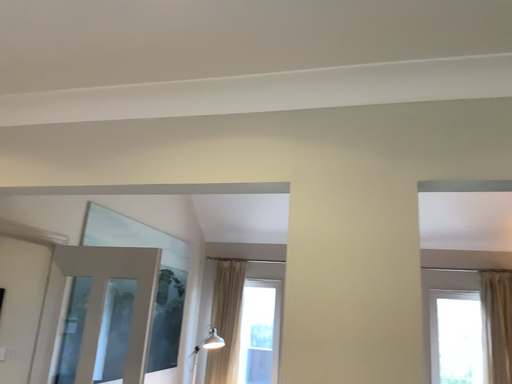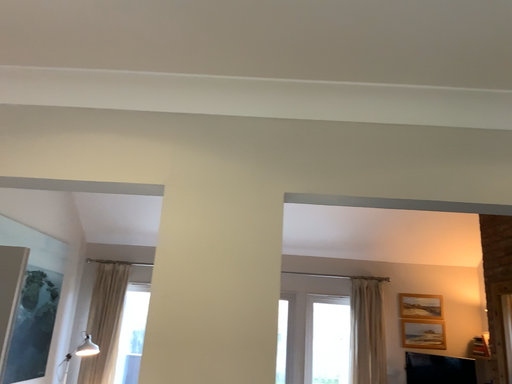
Question: Which way did the camera rotate in the video?

Choices:
 (A) rotated right
 (B) rotated left

Answer: (A)